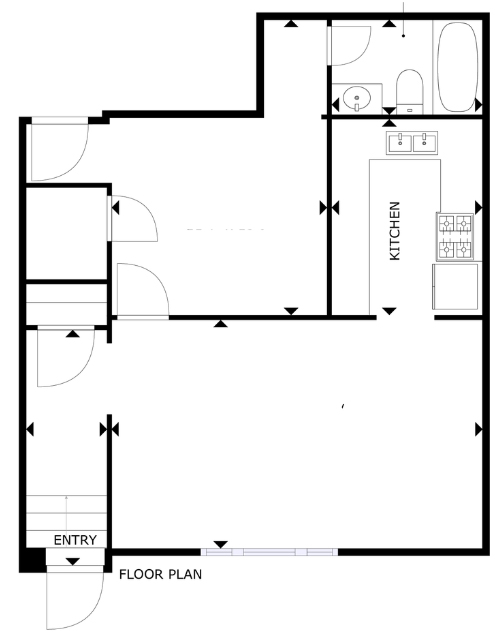
Image resolution: width=500 pixels, height=642 pixels. Identify the location of bathtub. (454, 65).